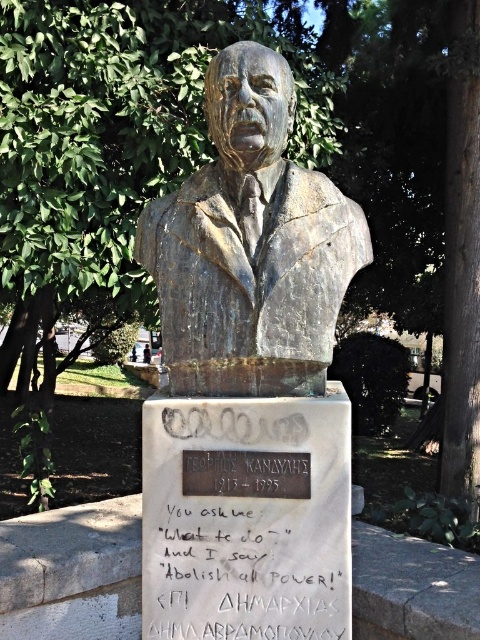
You are a tour guide explaining the sculpture to visitors. Pointing at the bronze bust at center and the bronze plaque at center, you want to mention their positions. Which one is nearer to the visitors?

The bronze bust at center is closer to the viewer than the bronze plaque at center.

You are an art conservator assessing the bronze bust at center and bronze plaque at center in the park. Which object has a greater width according to the description?

The bronze bust at center has a greater width than the bronze plaque at center.

You are a photographer standing in front of the bronze bust in the park. You want to take a photo that includes both the point at coordinates point (300, 202) and point (274, 608). Which point should you focus on first to ensure both are in sharp focus?

You should focus on point (300, 202) first because it is closer to the camera than point (274, 608). This ensures the closer point is in focus, and the farther point will also be sharp due to depth of field.